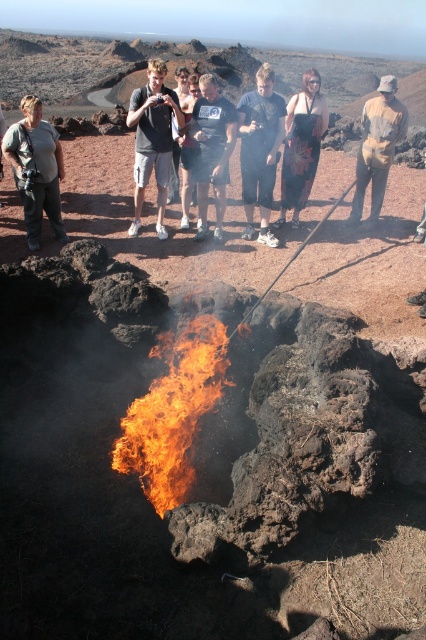
Question: Estimate the real-world distances between objects in this image. Which object is closer to the dark gray t-shirt at center?

Choices:
 (A) blue denim shorts at center
 (B) floral skirt at center
 (C) black cotton shirt at center
 (D) matte gray shirt at center

Answer: (A)

Question: Does flameorange/redflame at center have a larger size compared to blue denim shorts at center?

Choices:
 (A) yes
 (B) no

Answer: (B)

Question: Where is matte gray shirt at center located in relation to black cotton shirt at center in the image?

Choices:
 (A) above
 (B) below

Answer: (B)

Question: Which object is positioned closest to the flameorange/redflame at center?

Choices:
 (A) matte gray shirt at center
 (B) dark gray t-shirt at center

Answer: (B)

Question: Which object is farther from the camera taking this photo?

Choices:
 (A) matte gray shirt at center
 (B) blue denim shorts at center
 (C) black cotton shirt at center

Answer: (B)

Question: Is blue denim shorts at center behind dark gray t-shirt at center?

Choices:
 (A) no
 (B) yes

Answer: (A)